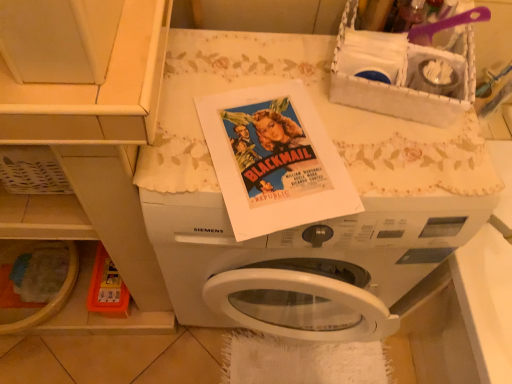
Question: From a real-world perspective, does white woven basket at upper right stand above white matte washing machine at center?

Choices:
 (A) no
 (B) yes

Answer: (B)

Question: Is white woven basket at upper right oriented away from white matte washing machine at center?

Choices:
 (A) no
 (B) yes

Answer: (A)

Question: Is white woven basket at upper right further to the viewer compared to white matte washing machine at center?

Choices:
 (A) no
 (B) yes

Answer: (A)

Question: Is there a large distance between white woven basket at upper right and white matte washing machine at center?

Choices:
 (A) no
 (B) yes

Answer: (A)

Question: Is white woven basket at upper right bigger than white matte washing machine at center?

Choices:
 (A) no
 (B) yes

Answer: (A)

Question: Does white woven basket at upper right have a greater height compared to white matte washing machine at center?

Choices:
 (A) no
 (B) yes

Answer: (A)

Question: Can you confirm if white matte washing machine at center is positioned to the right of white woven basket at upper right?

Choices:
 (A) yes
 (B) no

Answer: (B)

Question: Does white matte washing machine at center have a smaller size compared to white woven basket at upper right?

Choices:
 (A) no
 (B) yes

Answer: (A)

Question: Is white matte washing machine at center located outside white woven basket at upper right?

Choices:
 (A) yes
 (B) no

Answer: (A)

Question: Is white matte washing machine at center positioned behind white woven basket at upper right?

Choices:
 (A) yes
 (B) no

Answer: (A)

Question: From the image's perspective, would you say white matte washing machine at center is shown under white woven basket at upper right?

Choices:
 (A) yes
 (B) no

Answer: (A)

Question: Is white matte washing machine at center positioned with its back to white woven basket at upper right?

Choices:
 (A) no
 (B) yes

Answer: (A)

Question: From the image's perspective, relative to white matte washing machine at center, is white woven basket at upper right above or below?

Choices:
 (A) above
 (B) below

Answer: (A)